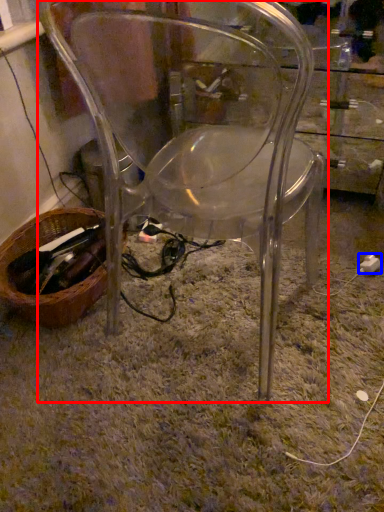
Question: Which object is closer to the camera taking this photo, chair (highlighted by a red box) or plug (highlighted by a blue box)?

Choices:
 (A) chair
 (B) plug

Answer: (A)